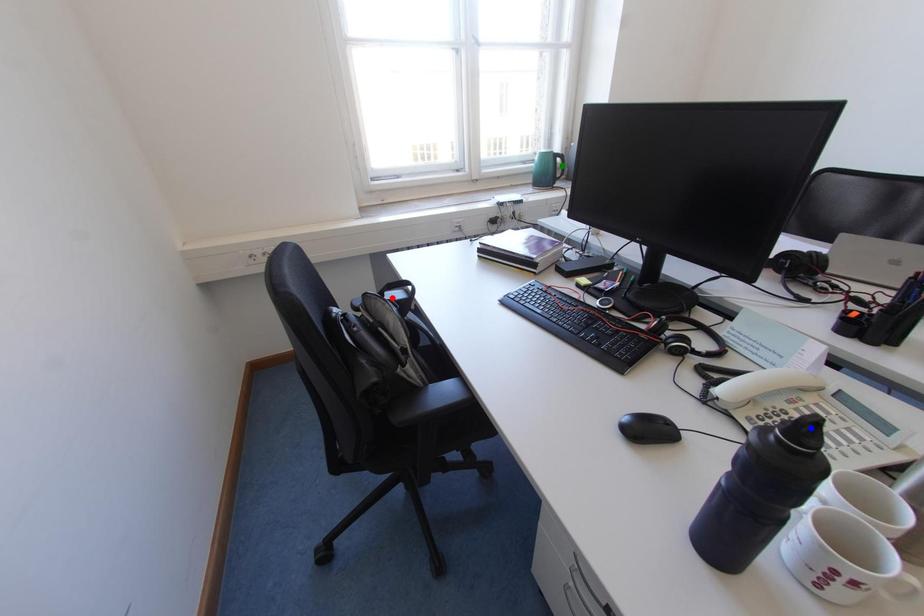
Order these from farthest to nearest:
A) red point
B) green point
C) blue point

green point < red point < blue point